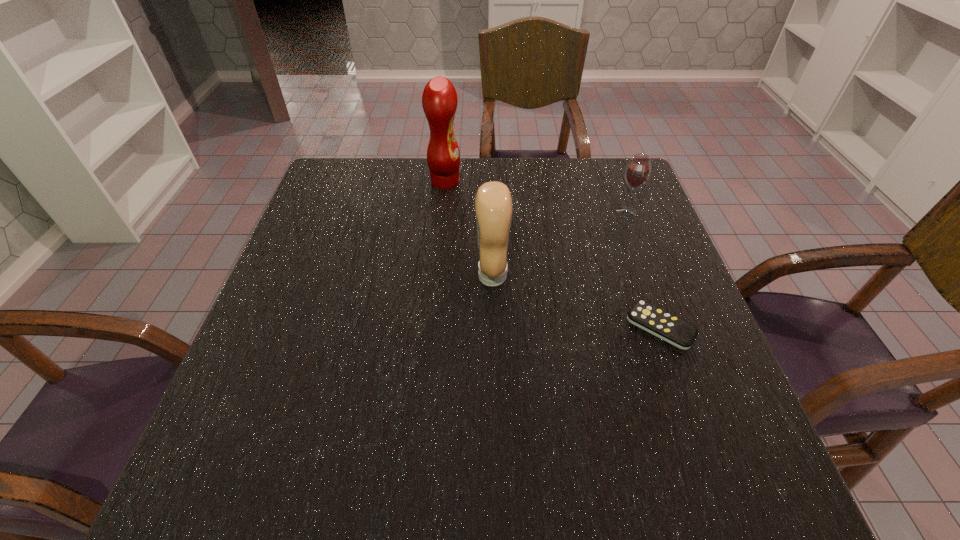
Where is `the tallest object`? Image resolution: width=960 pixels, height=540 pixels. the tallest object is located at coordinates (439, 100).

Where is `the taller condiment`? This screenshot has height=540, width=960. the taller condiment is located at coordinates (439, 100).

Where is `the second object from left to right`? This screenshot has height=540, width=960. the second object from left to right is located at coordinates (493, 203).

You are a GUI agent. You are given a task and a screenshot of the screen. Output one action in this format:
    pyautogui.click(x=<x>, y=<y>)
    Task: Click on the shorter condiment
    The image size is (960, 540).
    Given the screenshot: What is the action you would take?
    pyautogui.click(x=493, y=203)

Locate an element on the screen. wineglass is located at coordinates (638, 170).

Locate an element on the screen. the second shortest object is located at coordinates [638, 170].

You are a GUI agent. You are given a task and a screenshot of the screen. Output one action in this format:
    pyautogui.click(x=<x>, y=<y>)
    Task: Click on the remote control
    This screenshot has width=960, height=540.
    Given the screenshot: What is the action you would take?
    pyautogui.click(x=656, y=321)

Locate an element on the screen. Image resolution: width=960 pixels, height=540 pixels. the shortest object is located at coordinates (656, 321).

Where is `vacant space situated 0.270m on the label side of the taller condiment`? The image size is (960, 540). vacant space situated 0.270m on the label side of the taller condiment is located at coordinates (556, 182).

In order to click on free space located 0.400m on the label of the third shortest object in this screenshot , I will do `click(299, 275)`.